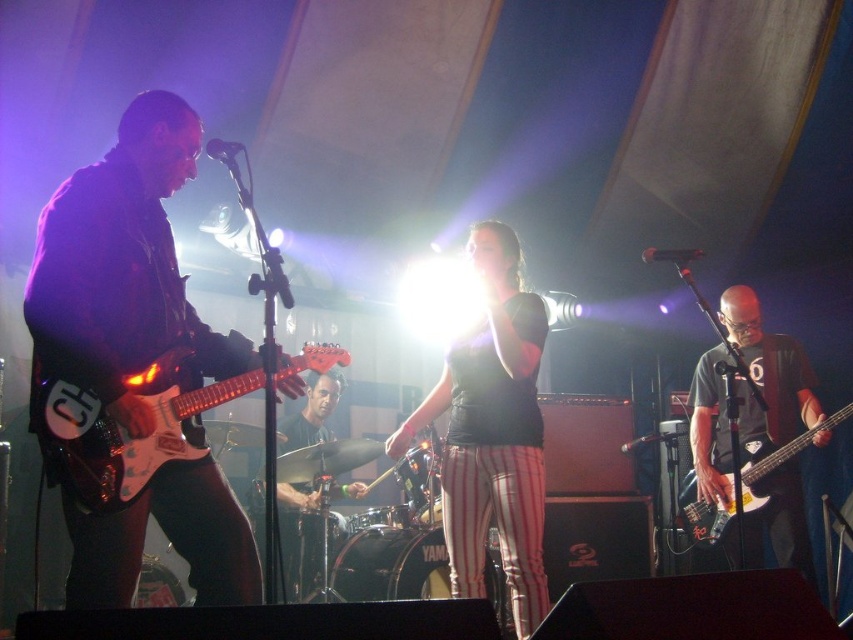
You are a photographer at the back of the venue. You want to take a photo of the black matte shirt at center. Where should you aim your camera to capture it?

You should aim your camera at the point with coordinates (492, 432) to capture the black matte shirt at center.

Based on the photo, you are a photographer at the concert. You need to capture a photo where both the black matte shirt at center and the black leather drumsticks at center are visible. Based on their heights, which one should you focus on to ensure both are in frame?

The black matte shirt at center is taller than the black leather drumsticks at center. To ensure both are in frame, focus on the black matte shirt at center as it is taller, allowing the shorter drumsticks to be captured below or alongside it.